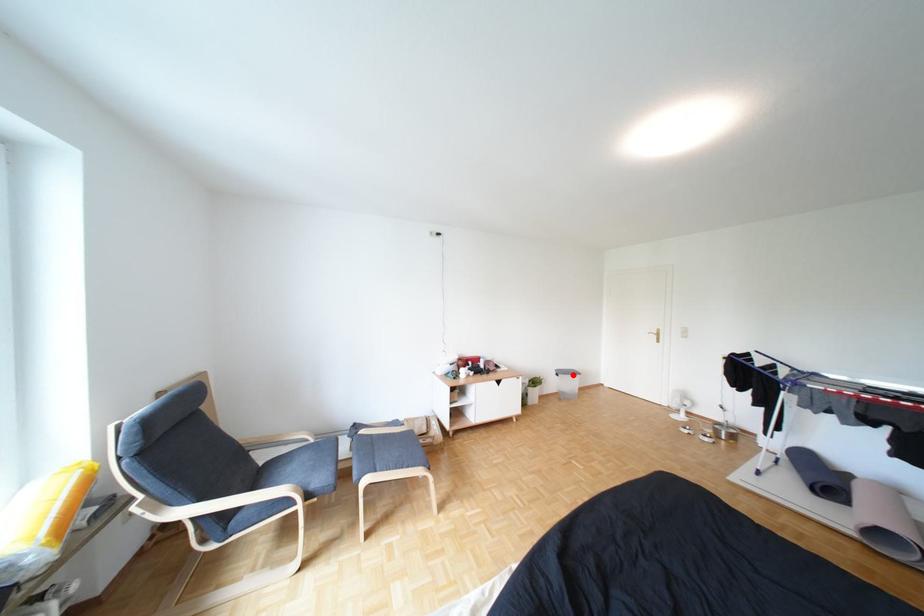
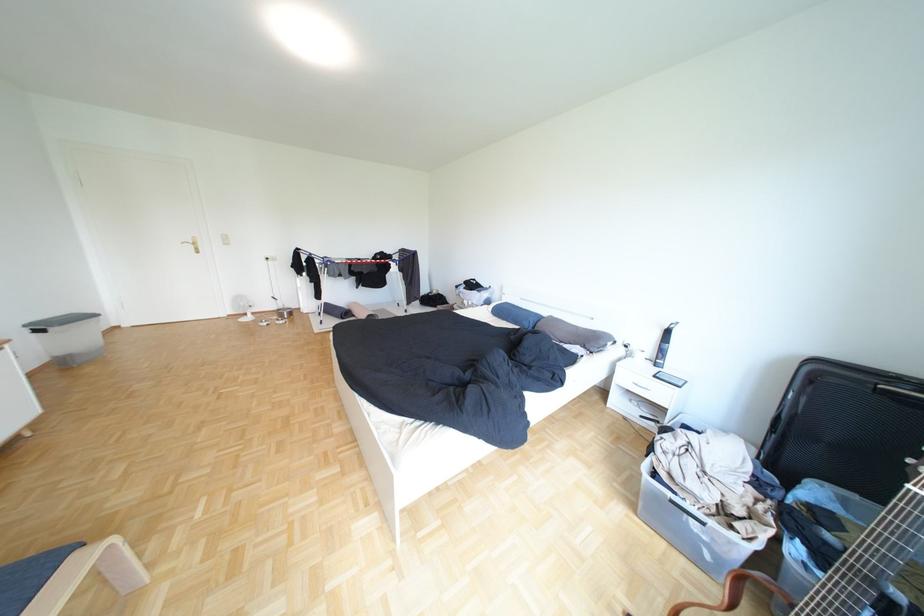
Question: I am providing you with two images of the same scene from different viewpoints. A red point is shown in image1. For the corresponding object point in image2, is it positioned nearer or farther from the camera?

Choices:
 (A) Nearer
 (B) Farther

Answer: (B)